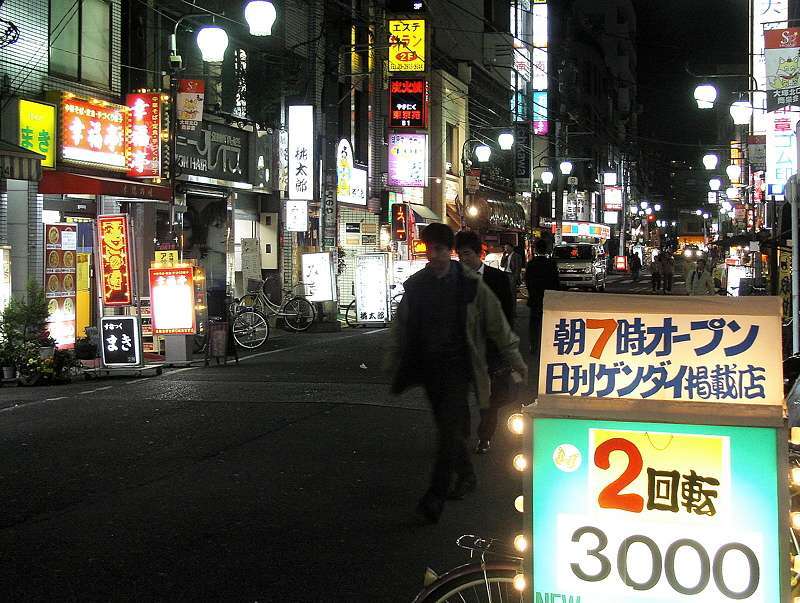
This screenshot has height=603, width=800. What are the coordinates of `coat` in the screenshot? It's located at (482, 313).